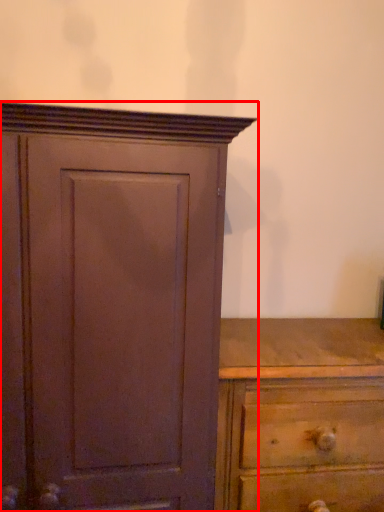
Question: Where is cupboard (annotated by the red box) located in relation to chest of drawers in the image?

Choices:
 (A) left
 (B) right

Answer: (A)